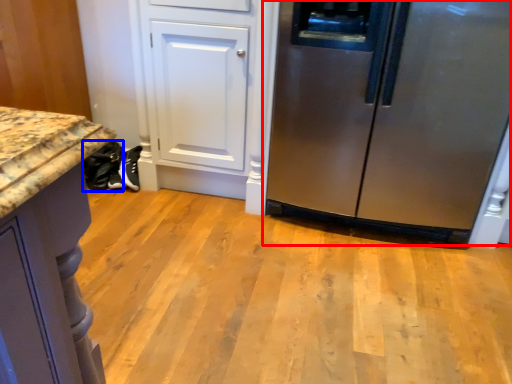
Question: Which object is further to the camera taking this photo, refrigerator (highlighted by a red box) or footwear (highlighted by a blue box)?

Choices:
 (A) refrigerator
 (B) footwear

Answer: (B)